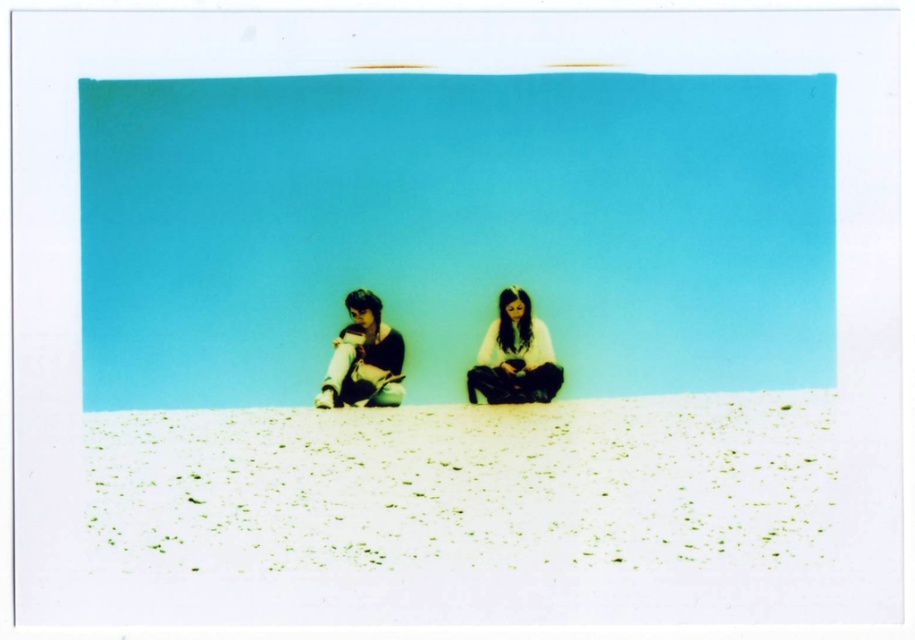
You are standing in front of the Polaroid photo and want to place a small seashell exactly where the white sandy ground at lower center is located. According to the coordinates provided, where should you place the seashell?

You should place the seashell at point (467, 483) on the white sandy ground at lower center as specified in the coordinates.

What are the coordinates of the white sandy ground at lower center in the image?

The white sandy ground at lower center is located at coordinates point (467, 483).

You are a photographer trying to capture a closeup of the white sandy ground at lower center. However, the matte white pants at center left are blocking your view. Can you move the pants to the side to get a clear shot?

The white sandy ground at lower center is below the matte white pants at center left, so moving the matte white pants at center left to the side would allow you to see the white sandy ground at lower center clearly.